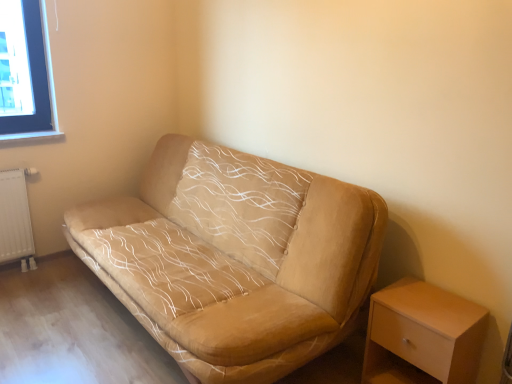
Question: From a real-world perspective, relative to white textured radiator at lower left, is white matte wooden table at lower right vertically above or below?

Choices:
 (A) above
 (B) below

Answer: (B)

Question: In the image, is white matte wooden table at lower right on the left side or the right side of white textured radiator at lower left?

Choices:
 (A) left
 (B) right

Answer: (B)

Question: Based on their relative distances, which object is farther from the beige fabric couch at center?

Choices:
 (A) white matte wooden table at lower right
 (B) white textured radiator at lower left

Answer: (B)

Question: Which is farther from the white textured radiator at lower left?

Choices:
 (A) white matte wooden table at lower right
 (B) beige fabric couch at center

Answer: (A)